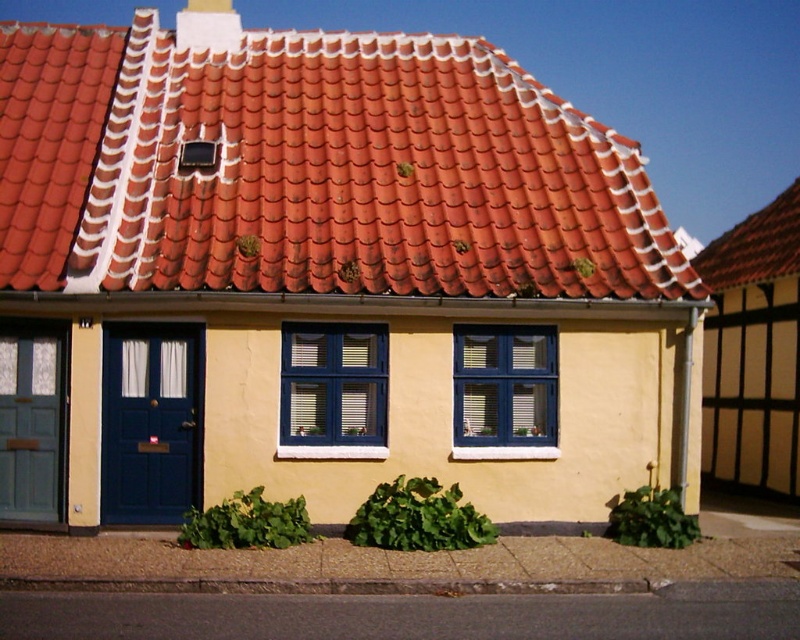
Question: Does matte blue door at lower left appear on the right side of teal wooden door at left?

Choices:
 (A) no
 (B) yes

Answer: (B)

Question: In this image, where is red clay tiles at upper center located relative to teal wooden door at left?

Choices:
 (A) below
 (B) above

Answer: (B)

Question: Can you confirm if matte blue door at lower left is wider than teal wooden door at left?

Choices:
 (A) no
 (B) yes

Answer: (B)

Question: Based on their relative distances, which object is nearer to the matte blue door at lower left?

Choices:
 (A) red clay tiles at upper center
 (B) teal wooden door at left

Answer: (B)

Question: Which point appears closest to the camera in this image?

Choices:
 (A) (118, 474)
 (B) (202, 268)
 (C) (20, 410)

Answer: (B)

Question: Among these objects, which one is nearest to the camera?

Choices:
 (A) red clay tiles at upper center
 (B) teal wooden door at left

Answer: (A)